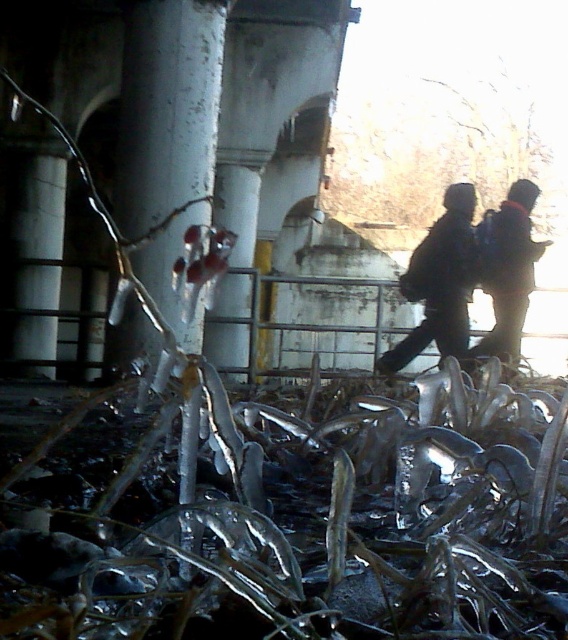
Question: Considering the real-world distances, which object is closest to the dark brown leather jacket at center?

Choices:
 (A) dark blue jacket at right
 (B) transparent ice at lower center
 (C) white matte overpass at center

Answer: (A)

Question: Which object is farther from the camera taking this photo?

Choices:
 (A) white matte overpass at center
 (B) transparent ice at lower center
 (C) white glossy pillar at center
 (D) dark brown leather jacket at center

Answer: (D)

Question: From the image, what is the correct spatial relationship of white matte overpass at center in relation to dark blue jacket at right?

Choices:
 (A) above
 (B) below

Answer: (B)

Question: Which point is farther to the camera?

Choices:
 (A) (110, 528)
 (B) (260, 116)

Answer: (B)

Question: Is dark brown leather jacket at center to the left of dark blue jacket at right from the viewer's perspective?

Choices:
 (A) yes
 (B) no

Answer: (A)

Question: Does white glossy pillar at center have a larger size compared to dark blue jacket at right?

Choices:
 (A) no
 (B) yes

Answer: (B)